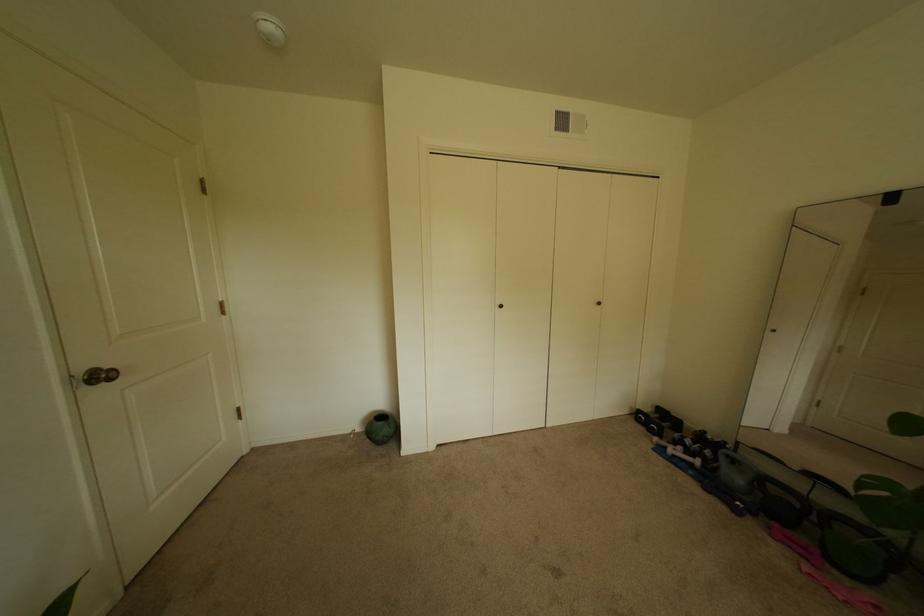
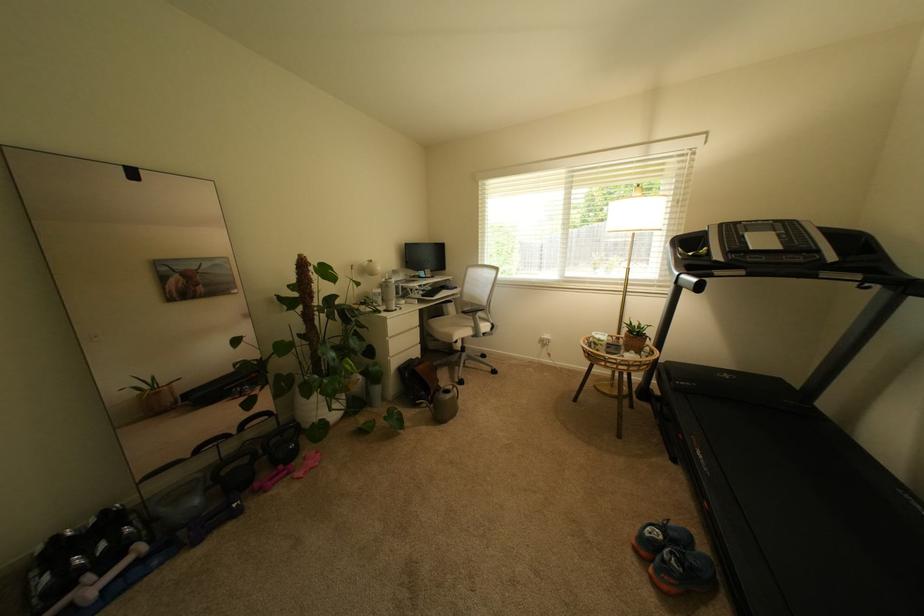
The point at (693, 455) is marked in the first image. Where is the corresponding point in the second image?

(111, 573)